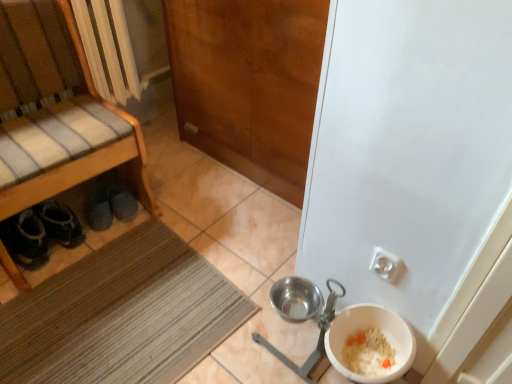
Question: Considering the relative sizes of white plastic bowl at lower right and wooden bench at left in the image provided, is white plastic bowl at lower right smaller than wooden bench at left?

Choices:
 (A) no
 (B) yes

Answer: (B)

Question: Is white plastic bowl at lower right positioned beyond the bounds of wooden bench at left?

Choices:
 (A) yes
 (B) no

Answer: (A)

Question: Is white plastic bowl at lower right beside wooden bench at left?

Choices:
 (A) no
 (B) yes

Answer: (A)

Question: Can you confirm if white plastic bowl at lower right is shorter than wooden bench at left?

Choices:
 (A) yes
 (B) no

Answer: (A)

Question: Considering the relative sizes of white plastic bowl at lower right and wooden bench at left in the image provided, is white plastic bowl at lower right bigger than wooden bench at left?

Choices:
 (A) yes
 (B) no

Answer: (B)

Question: Does white plastic bowl at lower right appear on the left side of wooden bench at left?

Choices:
 (A) yes
 (B) no

Answer: (B)

Question: Would you say brown textured mat at lower left is part of wooden door at center's contents?

Choices:
 (A) no
 (B) yes

Answer: (A)

Question: Is the depth of wooden door at center greater than that of brown textured mat at lower left?

Choices:
 (A) yes
 (B) no

Answer: (A)

Question: From the image's perspective, is wooden door at center below brown textured mat at lower left?

Choices:
 (A) no
 (B) yes

Answer: (A)

Question: Considering the relative positions of wooden door at center and brown textured mat at lower left in the image provided, is wooden door at center to the left of brown textured mat at lower left from the viewer's perspective?

Choices:
 (A) yes
 (B) no

Answer: (B)

Question: Is wooden door at center shorter than brown textured mat at lower left?

Choices:
 (A) yes
 (B) no

Answer: (B)

Question: Is wooden door at center thinner than brown textured mat at lower left?

Choices:
 (A) yes
 (B) no

Answer: (A)

Question: Can you confirm if wooden bench at left is positioned to the right of white plastic bowl at lower right?

Choices:
 (A) yes
 (B) no

Answer: (B)